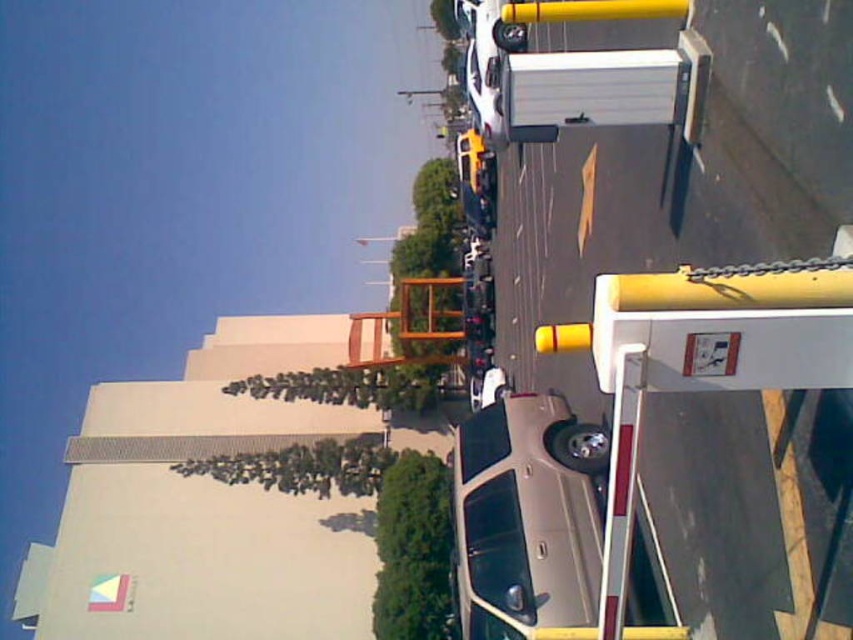
Question: Is satin silver sedan at center closer to camera compared to yellow matte traffic light at center?

Choices:
 (A) no
 (B) yes

Answer: (A)

Question: Which of the following is the closest to the observer?

Choices:
 (A) (554, 328)
 (B) (547, 556)

Answer: (A)

Question: Is satin silver sedan at center closer to the viewer compared to yellow matte traffic light at center?

Choices:
 (A) yes
 (B) no

Answer: (B)

Question: Which point is farther to the camera?

Choices:
 (A) (566, 339)
 (B) (468, 636)

Answer: (B)

Question: Does satin silver sedan at center appear on the right side of yellow matte traffic light at center?

Choices:
 (A) yes
 (B) no

Answer: (B)

Question: Which point is farther to the camera?

Choices:
 (A) satin silver sedan at center
 (B) yellow matte traffic light at center

Answer: (A)